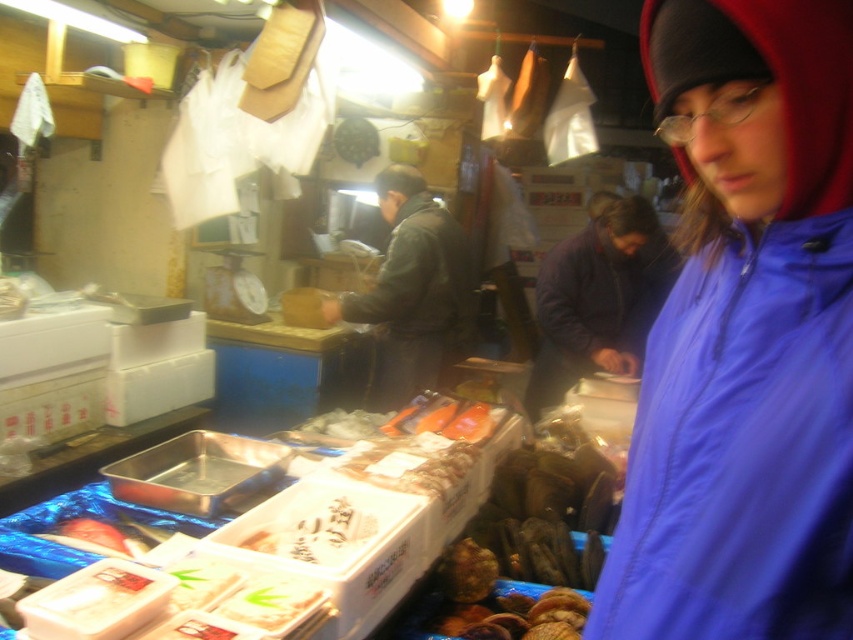
Question: Can you confirm if blue fabric jacket at center is positioned below leather jacket at center?

Choices:
 (A) yes
 (B) no

Answer: (A)

Question: Estimate the real-world distances between objects in this image. Which object is closer to the blue fabric jacket at center?

Choices:
 (A) dark blue jacket at center
 (B) leather jacket at center

Answer: (B)

Question: Does dark blue jacket at center come in front of leather jacket at center?

Choices:
 (A) yes
 (B) no

Answer: (A)

Question: Does blue fabric jacket at center have a lesser width compared to leather jacket at center?

Choices:
 (A) no
 (B) yes

Answer: (B)

Question: Among these objects, which one is farthest from the camera?

Choices:
 (A) blue fabric jacket at center
 (B) leather jacket at center
 (C) dark blue jacket at center

Answer: (B)

Question: Among these points, which one is nearest to the camera?

Choices:
 (A) (691, 284)
 (B) (612, 305)

Answer: (A)